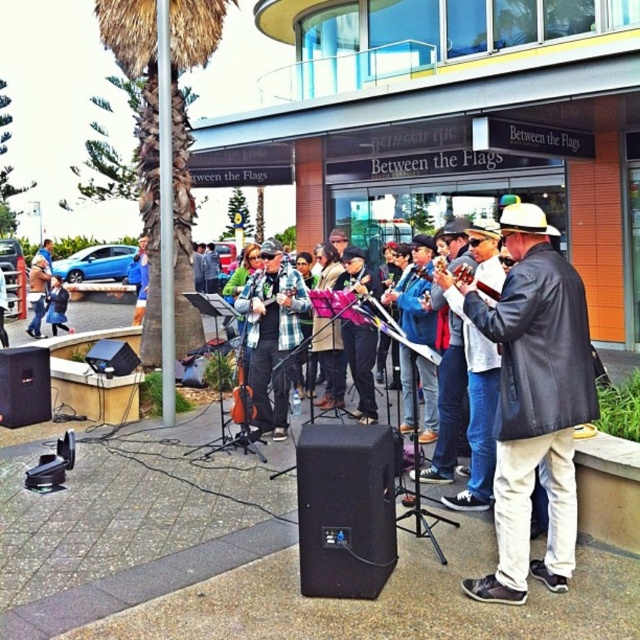
Question: Can you confirm if leather jacket at center is thinner than matte black jacket at center?

Choices:
 (A) yes
 (B) no

Answer: (B)

Question: Is leather jacket at center bigger than green leafy palm tree at left?

Choices:
 (A) no
 (B) yes

Answer: (B)

Question: Which object is positioned farthest from the green leafy palm tree at left?

Choices:
 (A) leather jacket at center
 (B) light brown leather jacket at center

Answer: (B)

Question: Which point appears closest to the camera in this image?

Choices:
 (A) (58, 300)
 (B) (141, 166)
 (C) (512, 273)
 (D) (29, 328)

Answer: (C)

Question: Can you confirm if light brown leather jacket at center is positioned above matte black jacket at center?

Choices:
 (A) yes
 (B) no

Answer: (A)

Question: Which object appears farthest from the camera in this image?

Choices:
 (A) green leafy palm tree at left
 (B) leather jacket at center

Answer: (A)